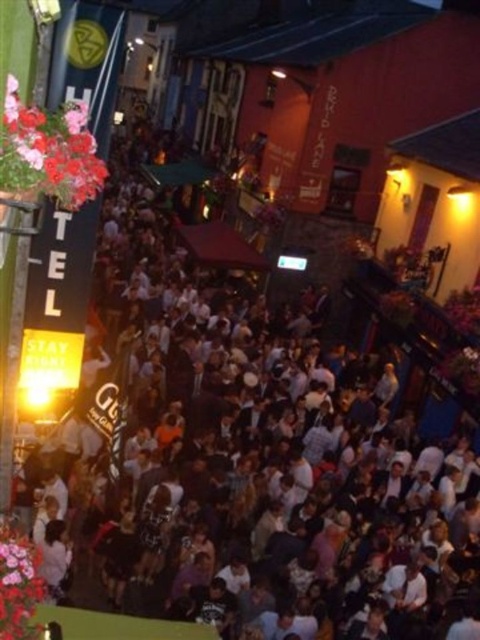
Question: Can you confirm if matte pink flowers at upper left is positioned to the right of pink floral bouquet at lower left?

Choices:
 (A) no
 (B) yes

Answer: (B)

Question: Which object appears farthest from the camera in this image?

Choices:
 (A) matte pink flowers at upper left
 (B) pink floral bouquet at lower left

Answer: (B)

Question: Does matte pink flowers at upper left have a greater width compared to pink floral bouquet at lower left?

Choices:
 (A) no
 (B) yes

Answer: (A)

Question: Considering the relative positions of matte pink flowers at upper left and pink floral bouquet at lower left in the image provided, where is matte pink flowers at upper left located with respect to pink floral bouquet at lower left?

Choices:
 (A) below
 (B) above

Answer: (B)